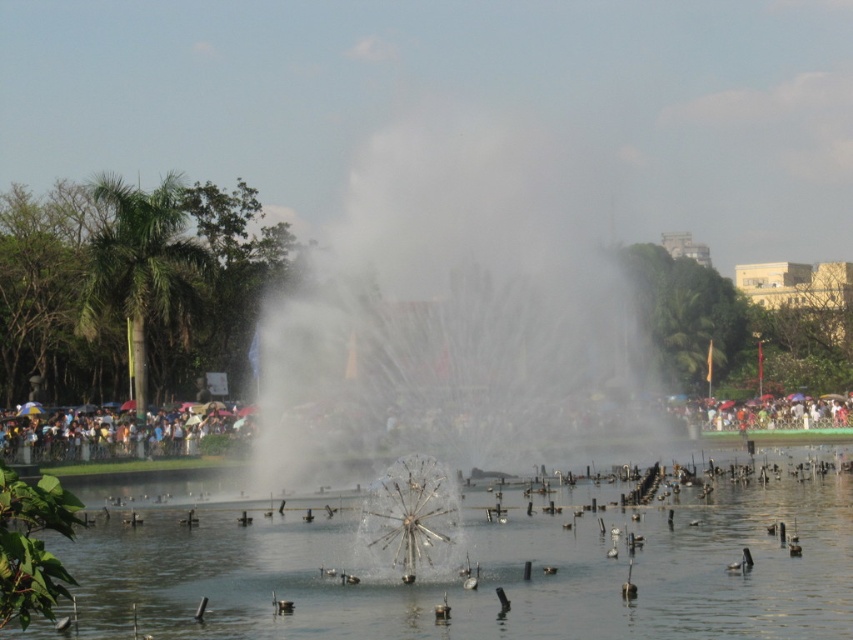
Who is positioned more to the left, clear water at center or white matte duck at center?

From the viewer's perspective, clear water at center appears more on the left side.

Is point (523, 588) closer to camera compared to point (747, 563)?

Yes.

The image size is (853, 640). Identify the location of clear water at center. (482, 572).

Does clear water at center have a greater width compared to matte black crowd at center?

In fact, clear water at center might be narrower than matte black crowd at center.

How much distance is there between clear water at center and matte black crowd at center?

The distance of clear water at center from matte black crowd at center is 115.44 feet.

At what (x,y) coordinates should I click in order to perform the action: click on clear water at center. Please return your answer as a coordinate pair (x, y). The width and height of the screenshot is (853, 640). Looking at the image, I should click on (482, 572).

Can you confirm if clear water at center is thinner than brown fuzzy duck at center?

No, clear water at center is not thinner than brown fuzzy duck at center.

Measure the distance between clear water at center and camera.

clear water at center and camera are 78.52 meters apart.

What do you see at coordinates (482, 572) in the screenshot? I see `clear water at center` at bounding box center [482, 572].

This screenshot has height=640, width=853. What are the coordinates of `clear water at center` in the screenshot? It's located at (482, 572).